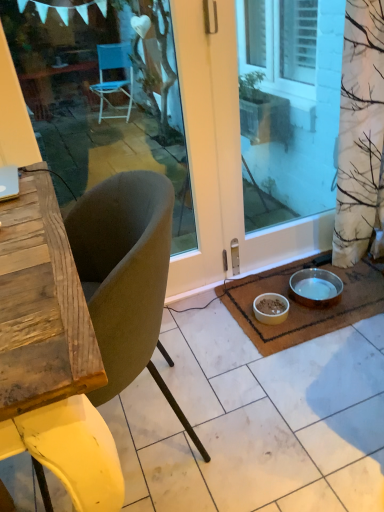
Question: Can you confirm if transparent glass door at center, the first window screen positioned from the right, is positioned to the left of white matte bowl at lower center, the first bowl viewed from the left?

Choices:
 (A) yes
 (B) no

Answer: (B)

Question: Is white matte bowl at lower center, the first bowl viewed from the left, at the back of transparent glass door at center, the second window screen in the left-to-right sequence?

Choices:
 (A) yes
 (B) no

Answer: (B)

Question: Are transparent glass door at center, the first window screen positioned from the right, and white matte bowl at lower center, the first bowl viewed from the left, making contact?

Choices:
 (A) no
 (B) yes

Answer: (A)

Question: Is transparent glass door at center, the second window screen in the left-to-right sequence, bigger than white matte bowl at lower center, the first bowl viewed from the left?

Choices:
 (A) yes
 (B) no

Answer: (A)

Question: Is white matte bowl at lower center, positioned as the second bowl in right-to-left order, inside transparent glass door at center, the first window screen positioned from the right?

Choices:
 (A) no
 (B) yes

Answer: (A)

Question: Is point (334, 50) closer or farther from the camera than point (281, 303)?

Choices:
 (A) farther
 (B) closer

Answer: (A)

Question: From the image's perspective, is transparent glass door at center, the second window screen in the left-to-right sequence, positioned above or below white matte bowl at lower center, the first bowl viewed from the left?

Choices:
 (A) below
 (B) above

Answer: (B)

Question: In terms of size, does transparent glass door at center, the first window screen positioned from the right, appear bigger or smaller than white matte bowl at lower center, the first bowl viewed from the left?

Choices:
 (A) big
 (B) small

Answer: (A)

Question: From a real-world perspective, relative to white matte bowl at lower center, positioned as the second bowl in right-to-left order, is transparent glass door at center, the first window screen positioned from the right, vertically above or below?

Choices:
 (A) below
 (B) above

Answer: (B)

Question: Is metallic silver bowl at lower right, marked as the second bowl in a left-to-right arrangement, bigger or smaller than transparent glass door at center, the first window screen positioned from the right?

Choices:
 (A) small
 (B) big

Answer: (A)

Question: Is point (301, 286) closer or farther from the camera than point (296, 175)?

Choices:
 (A) farther
 (B) closer

Answer: (B)

Question: From a real-world perspective, relative to transparent glass door at center, the second window screen in the left-to-right sequence, is metallic silver bowl at lower right, marked as the second bowl in a left-to-right arrangement, vertically above or below?

Choices:
 (A) above
 (B) below

Answer: (B)

Question: Considering the positions of metallic silver bowl at lower right, marked as the second bowl in a left-to-right arrangement, and transparent glass door at center, the second window screen in the left-to-right sequence, in the image, is metallic silver bowl at lower right, marked as the second bowl in a left-to-right arrangement, wider or thinner than transparent glass door at center, the second window screen in the left-to-right sequence,?

Choices:
 (A) wide
 (B) thin

Answer: (A)

Question: Is point (145, 181) closer or farther from the camera than point (317, 188)?

Choices:
 (A) farther
 (B) closer

Answer: (B)

Question: Is velvet-like beige chair at center in front of or behind transparent glass door at center, the second window screen in the left-to-right sequence, in the image?

Choices:
 (A) behind
 (B) front

Answer: (B)